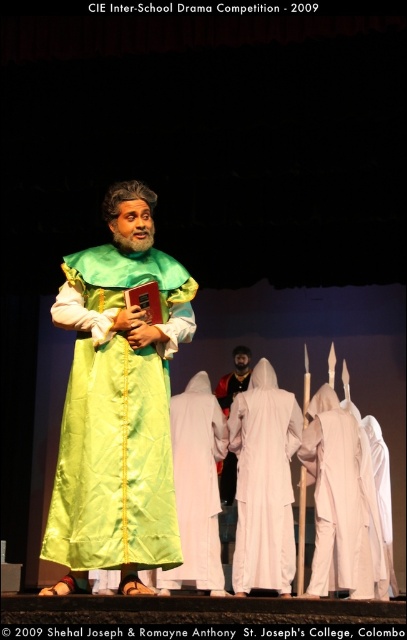
Based on the scene from the CIE Inter School Drama Competition at St. Joseph College, Colombo, where the green satin robe at center is positioned at coordinates 0.633, 0.290, can you determine if it is closer to the front edge of the stage or the back edge?

The green satin robe at center is located at point [118,404], which places it closer to the front edge of the stage since the coordinates suggest it is positioned near the lower part of the stage area.

From the picture: You are an audience member sitting in the front row of the CIE Inter School Drama Competition. You notice two white robes at center stage. Which one would appear closer to you, the white matte robe at center or the white cotton robe at center?

The white matte robe at center appears closer to you because it is further to the viewer than the white cotton robe at center.

You are a costume designer preparing for a play. You have two robes available for the lead character. One is a white matte robe at center and the other is a white cotton robe at center. Based on the scene description, which robe is wider?

The white matte robe at center is wider than the white cotton robe at center according to the description.